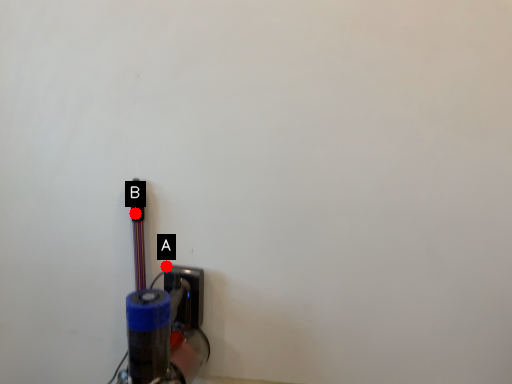
Question: Two points are circled on the image, labeled by A and B beside each circle. Which of the following is the farthest from the observer?

Choices:
 (A) A is further
 (B) B is further

Answer: (A)